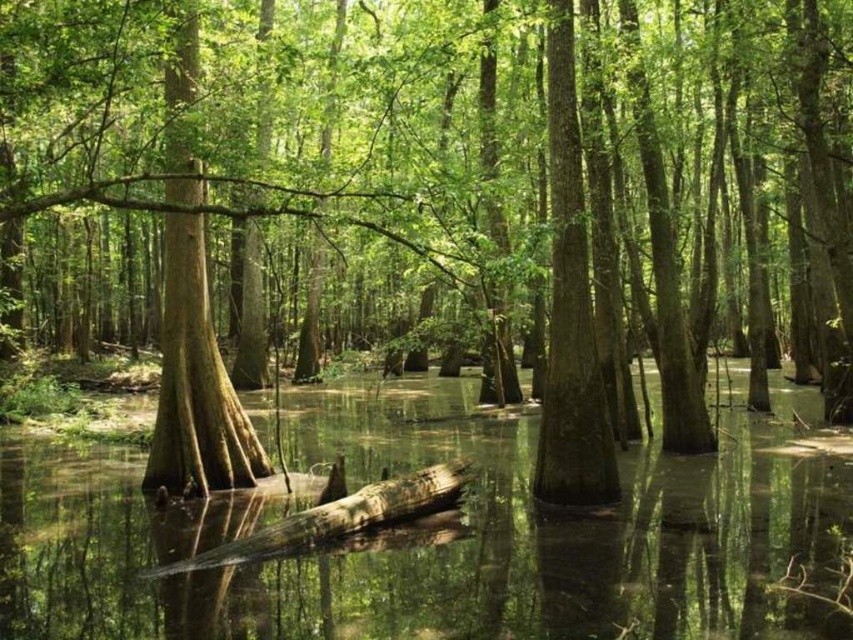
Is clear water at center thinner than smooth brown tree trunk at center?

In fact, clear water at center might be wider than smooth brown tree trunk at center.

The width and height of the screenshot is (853, 640). Identify the location of clear water at center. (432, 536).

Which is more to the right, smooth brown tree trunk at center or brown rough log at center?

smooth brown tree trunk at center

Which is above, smooth brown tree trunk at center or brown rough log at center?

smooth brown tree trunk at center is above.

I want to click on smooth brown tree trunk at center, so click(x=570, y=308).

At what (x,y) coordinates should I click in order to perform the action: click on smooth brown tree trunk at center. Please return your answer as a coordinate pair (x, y). Looking at the image, I should click on (570, 308).

Does point (135, 637) come farther from viewer compared to point (215, 396)?

No, (135, 637) is closer to viewer.

Does clear water at center appear under green rough bark tree trunk at center?

Yes.

Who is more distant from viewer, (7, 456) or (248, 419)?

Positioned behind is point (7, 456).

I want to click on clear water at center, so coord(432,536).